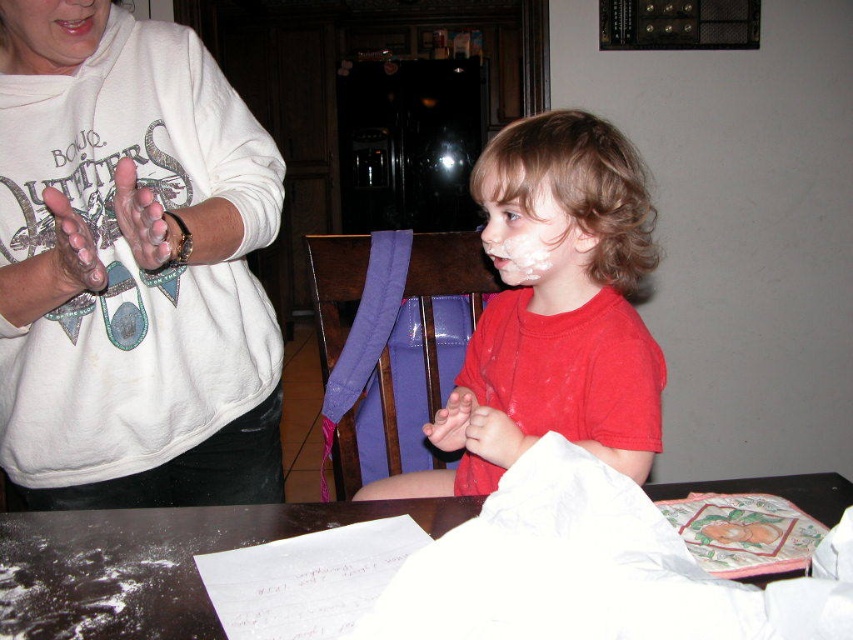
What is located at the coordinate point [136,280] in the image?

The white matte sweatshirt at upper left is located at point [136,280].

You are standing in the kitchen and want to place a plate of cookies on the white matte table at lower center. However, there is a white matte face at center in the way. Which object should you move to access the table?

The white matte face at center is in front of the white matte table at lower center, so you should move the white matte face at center to access the table.

Based on the scene description, where is the white matte face at center located in terms of coordinates?

The white matte face at center is located at coordinates point [531,236].